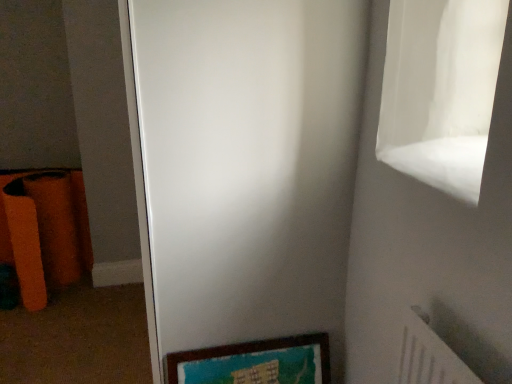
You are a GUI agent. You are given a task and a screenshot of the screen. Output one action in this format:
    pyautogui.click(x=<x>, y=<y>)
    Task: Click on the wooden picture frame at lower center
    The image size is (512, 384).
    Given the screenshot: What is the action you would take?
    pyautogui.click(x=255, y=362)

This screenshot has height=384, width=512. Describe the element at coordinates (255, 362) in the screenshot. I see `wooden picture frame at lower center` at that location.

What is the approximate width of wooden picture frame at lower center?

5.06 inches.

Measure the distance between point (302, 221) and camera.

They are 1.31 meters apart.

The width and height of the screenshot is (512, 384). Describe the element at coordinates (247, 166) in the screenshot. I see `white matte screen door at center` at that location.

I want to click on white matte screen door at center, so click(x=247, y=166).

Where is `wooden picture frame at lower center`? The image size is (512, 384). wooden picture frame at lower center is located at coordinates (255, 362).

Between wooden picture frame at lower center and white matte screen door at center, which one appears on the right side from the viewer's perspective?

Positioned to the right is wooden picture frame at lower center.

Which object is closer to the camera taking this photo, wooden picture frame at lower center or white matte screen door at center?

white matte screen door at center.

Is point (328, 383) less distant than point (159, 33)?

No, it is behind (159, 33).

From the image's perspective, is wooden picture frame at lower center located above or below white matte screen door at center?

From the image's perspective, wooden picture frame at lower center appears below white matte screen door at center.

From a real-world perspective, which object rests below the other?

wooden picture frame at lower center, from a real-world perspective.

Considering the sizes of objects wooden picture frame at lower center and white matte screen door at center in the image provided, who is thinner, wooden picture frame at lower center or white matte screen door at center?

wooden picture frame at lower center.

Is wooden picture frame at lower center taller than white matte screen door at center?

No.

Can you confirm if wooden picture frame at lower center is smaller than white matte screen door at center?

Indeed, wooden picture frame at lower center has a smaller size compared to white matte screen door at center.

Is wooden picture frame at lower center situated inside white matte screen door at center or outside?

wooden picture frame at lower center is located inside white matte screen door at center.

Does wooden picture frame at lower center touch white matte screen door at center?

No, wooden picture frame at lower center is not touching white matte screen door at center.

Is wooden picture frame at lower center facing towards white matte screen door at center?

No, wooden picture frame at lower center is not facing towards white matte screen door at center.

How different are the orientations of wooden picture frame at lower center and white matte screen door at center in degrees?

The angular difference between wooden picture frame at lower center and white matte screen door at center is 90.5 degrees.

In the image, there is a wooden picture frame at lower center. Identify the location of screen door above it (from the image's perspective). This screenshot has width=512, height=384. (247, 166).

Is white matte screen door at center at the left side of wooden picture frame at lower center?

Yes, white matte screen door at center is to the left of wooden picture frame at lower center.

Between white matte screen door at center and wooden picture frame at lower center, which one is positioned in front?

white matte screen door at center is in front.

Does point (237, 18) come farther from viewer compared to point (306, 347)?

No, it is not.

In the scene shown: From the image's perspective, between white matte screen door at center and wooden picture frame at lower center, who is located below?

wooden picture frame at lower center, from the image's perspective.

From a real-world perspective, is white matte screen door at center below wooden picture frame at lower center?

Actually, white matte screen door at center is physically above wooden picture frame at lower center in the real world.

Does white matte screen door at center have a greater width compared to wooden picture frame at lower center?

Correct, the width of white matte screen door at center exceeds that of wooden picture frame at lower center.

Can you confirm if white matte screen door at center is taller than wooden picture frame at lower center?

Yes.

From the picture: Considering the relative sizes of white matte screen door at center and wooden picture frame at lower center in the image provided, is white matte screen door at center bigger than wooden picture frame at lower center?

Yes.

Looking at this image, does white matte screen door at center contain wooden picture frame at lower center?

Yes, wooden picture frame at lower center is inside white matte screen door at center.

Is white matte screen door at center next to wooden picture frame at lower center and touching it?

white matte screen door at center and wooden picture frame at lower center are not in contact.

Is white matte screen door at center turned away from wooden picture frame at lower center?

That's not correct — white matte screen door at center is not looking away from wooden picture frame at lower center.

How different are the orientations of white matte screen door at center and wooden picture frame at lower center in degrees?

90.5 degrees separate the facing orientations of white matte screen door at center and wooden picture frame at lower center.

Measure the distance between white matte screen door at center and wooden picture frame at lower center.

white matte screen door at center and wooden picture frame at lower center are 15.35 inches apart from each other.

Image resolution: width=512 pixels, height=384 pixels. Identify the location of screen door above the wooden picture frame at lower center (from a real-world perspective). (247, 166).

Where is `picture frame behind the white matte screen door at center`? Image resolution: width=512 pixels, height=384 pixels. picture frame behind the white matte screen door at center is located at coordinates pyautogui.click(x=255, y=362).

I want to click on picture frame located underneath the white matte screen door at center (from a real-world perspective), so click(255, 362).